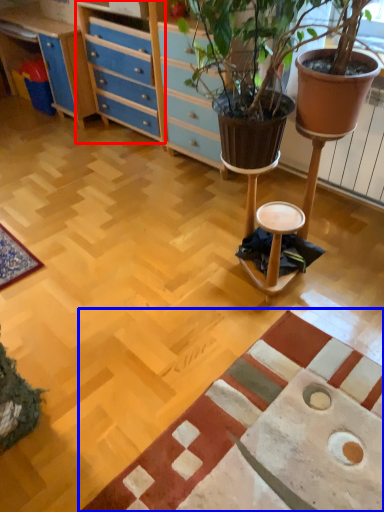
Question: Among these objects, which one is nearest to the camera, file cabinet (highlighted by a red box) or mat (highlighted by a blue box)?

Choices:
 (A) file cabinet
 (B) mat

Answer: (B)